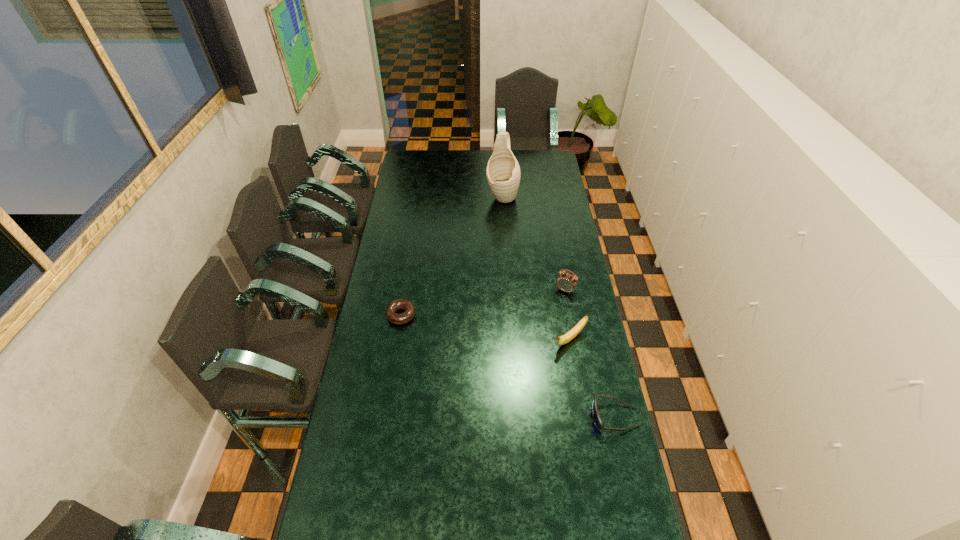
Image resolution: width=960 pixels, height=540 pixels. What are the coordinates of `free point located at the stem of the fourth farthest object` in the screenshot? It's located at (494, 399).

Find the location of a particular element. Image resolution: width=960 pixels, height=540 pixels. free space located at the stem of the fourth farthest object is located at coordinates (538, 364).

This screenshot has height=540, width=960. Find the location of `free spot located 0.250m at the stem of the fourth farthest object`. free spot located 0.250m at the stem of the fourth farthest object is located at coordinates (511, 386).

Where is `object at the left edge`? This screenshot has width=960, height=540. object at the left edge is located at coordinates (408, 306).

In order to click on sunglasses situated at the right edge in this screenshot , I will do `click(596, 417)`.

Locate an element on the screen. The image size is (960, 540). alarm clock that is at the right edge is located at coordinates (567, 282).

This screenshot has width=960, height=540. Identify the location of banana that is at the right edge. (564, 339).

In the image, there is a desktop. Identify the location of vacant space at the far edge. (475, 156).

The image size is (960, 540). In the image, there is a desktop. Identify the location of vacant space at the near edge. (389, 522).

Find the location of a particular element. free location at the left edge is located at coordinates (371, 316).